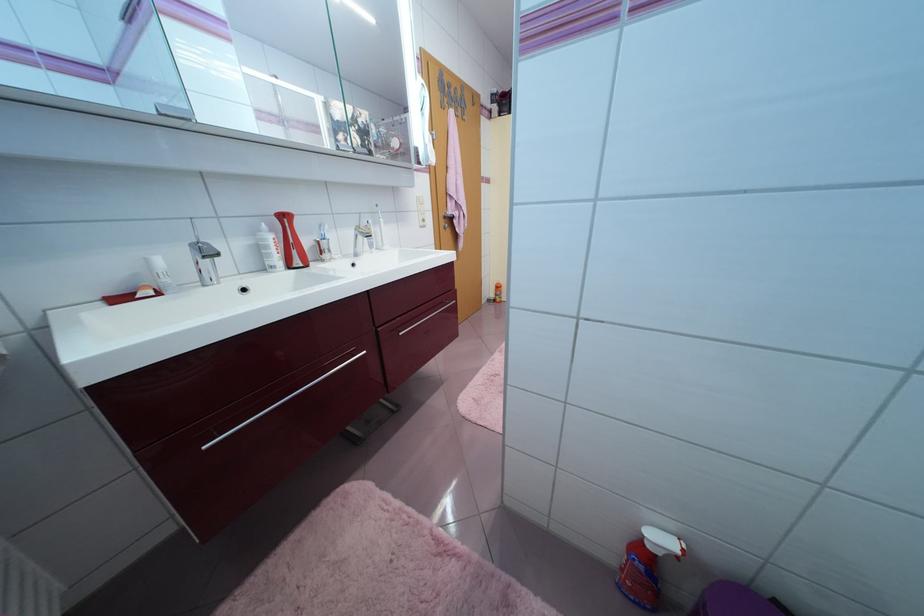
This screenshot has height=616, width=924. In order to click on electric toothbrush in this screenshot , I will do `click(290, 241)`.